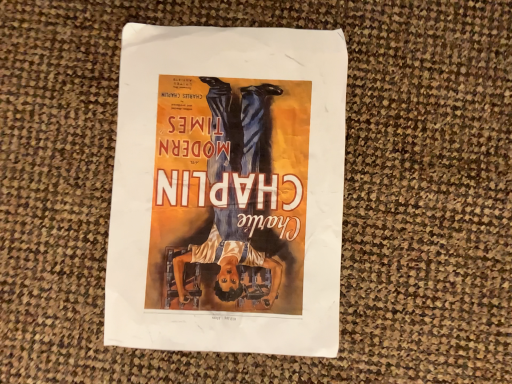
This screenshot has width=512, height=384. Describe the element at coordinates (228, 190) in the screenshot. I see `matte paper poster at center` at that location.

Where is `matte paper poster at center`? matte paper poster at center is located at coordinates (228, 190).

Locate an element on the screen. This screenshot has width=512, height=384. matte paper poster at center is located at coordinates (228, 190).